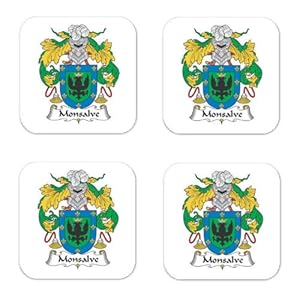
Locate an element on the screen. tassels is located at coordinates (x=199, y=246), (x=244, y=246), (x=53, y=243), (x=99, y=246), (x=55, y=99), (x=100, y=99), (x=197, y=100), (x=244, y=98).